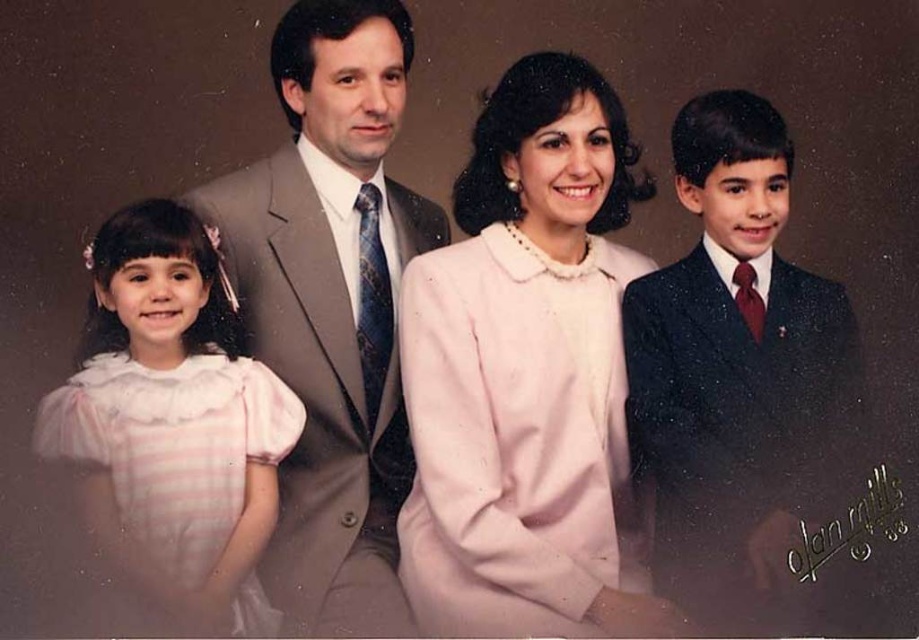
Question: Based on their relative distances, which object is farther from the pink satin dress at left?

Choices:
 (A) pink satin blouse at center
 (B) matte gray suit at center

Answer: (A)

Question: Which is nearer to the pink satin blouse at center?

Choices:
 (A) pink satin dress at left
 (B) matte gray suit at center

Answer: (B)

Question: Which object is the farthest from the matte gray suit at center?

Choices:
 (A) pink satin blouse at center
 (B) shiny dark blue suit at right
 (C) pink satin dress at left

Answer: (B)

Question: Is pink satin blouse at center bigger than shiny dark blue suit at right?

Choices:
 (A) yes
 (B) no

Answer: (A)

Question: Does matte gray suit at center appear on the left side of shiny dark blue suit at right?

Choices:
 (A) no
 (B) yes

Answer: (B)

Question: Considering the relative positions of matte gray suit at center and shiny dark blue suit at right in the image provided, where is matte gray suit at center located with respect to shiny dark blue suit at right?

Choices:
 (A) above
 (B) below

Answer: (A)